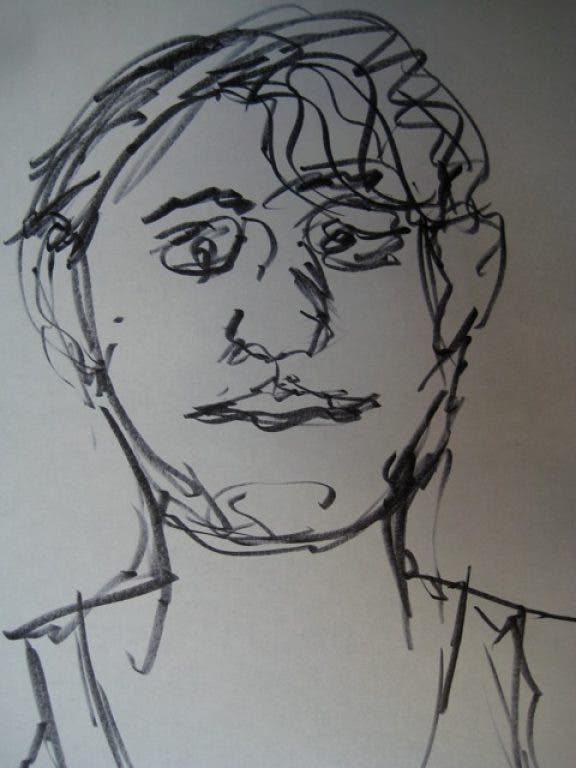
Find the location of a particular element. The width and height of the screenshot is (576, 768). chest is located at coordinates (278, 703).